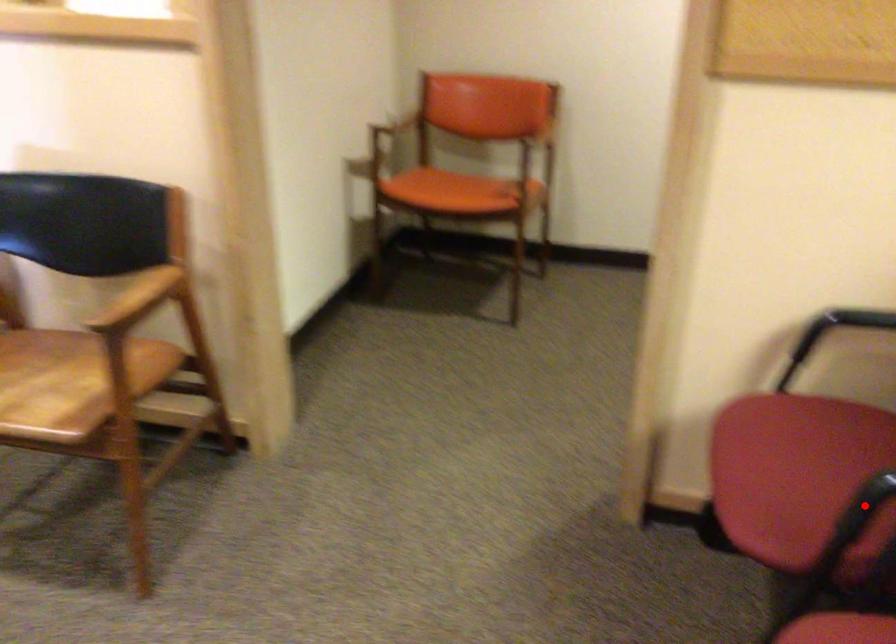
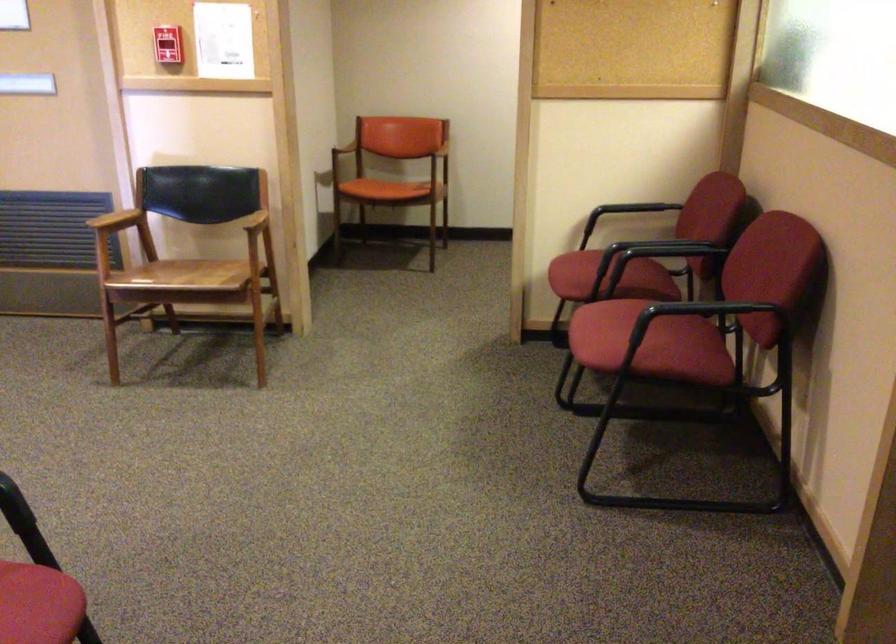
Locate, in the second image, the point that corresponds to the highlighted location in the first image.

(598, 258)